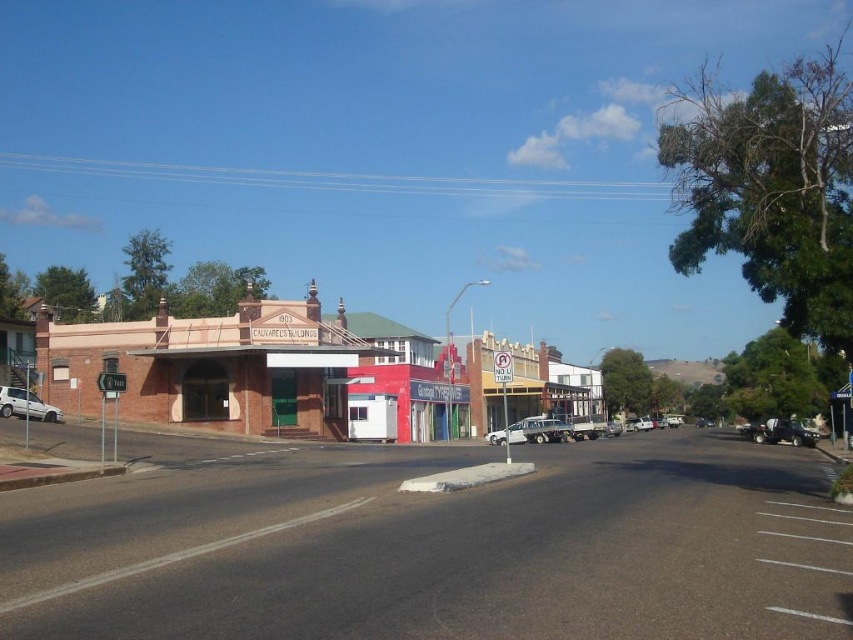
You are driving a car and see the smooth asphalt road at center and the metallic silver sedan at center. Which object is located to the left side?

The smooth asphalt road at center is to the left of the metallic silver sedan at center.

You are standing at the point with coordinates point (711,420) and want to walk to the point (521,506). According to the scene, which direction should you face to walk directly towards your destination?

You should face the direction towards point (521,506), which is in front of point (711,420), so you need to walk forward in that direction.

You are driving a delivery van that is 10 meters long and need to navigate through the street shown in the image. The van requires a minimum of 100 meters of clear space to make a safe turn. Are the white matte car at lower left and metallic silver sedan at center positioned in a way that allows enough space for your van to turn safely?

The white matte car at lower left is 95.16 meters from the metallic silver sedan at center. Since the required minimum space is 100 meters, the distance between them is insufficient for the van to turn safely.